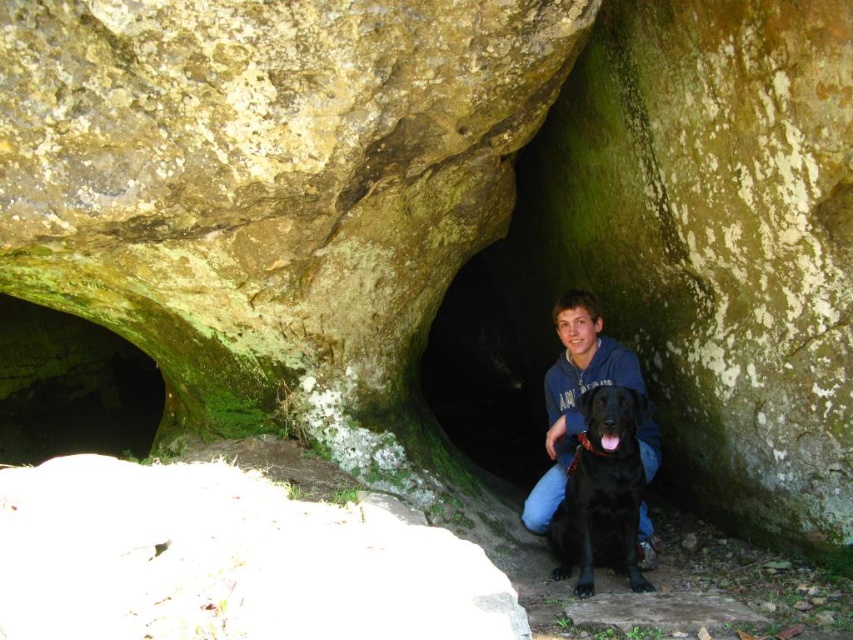
What do you see at coordinates (71, 387) in the screenshot? I see `green mossy cave at upper left` at bounding box center [71, 387].

The width and height of the screenshot is (853, 640). I want to click on green mossy cave at upper left, so click(x=71, y=387).

Who is shorter, green mossy cave at upper left or shiny black dog at center?

shiny black dog at center is shorter.

Which is more to the right, green mossy cave at upper left or shiny black dog at center?

From the viewer's perspective, shiny black dog at center appears more on the right side.

Is point (79, 428) positioned after point (576, 545)?

Yes, it is behind point (576, 545).

You are a GUI agent. You are given a task and a screenshot of the screen. Output one action in this format:
    pyautogui.click(x=<x>, y=<y>)
    Task: Click on the green mossy cave at upper left
    The height and width of the screenshot is (640, 853).
    Given the screenshot: What is the action you would take?
    pyautogui.click(x=71, y=387)

How far apart are shiny black dog at center and blue fleece jacket at center?

13.24 centimeters

Consider the image. Is shiny black dog at center to the right of blue fleece jacket at center from the viewer's perspective?

No, shiny black dog at center is not to the right of blue fleece jacket at center.

Where is `shiny black dog at center`? Image resolution: width=853 pixels, height=640 pixels. shiny black dog at center is located at coordinates (602, 492).